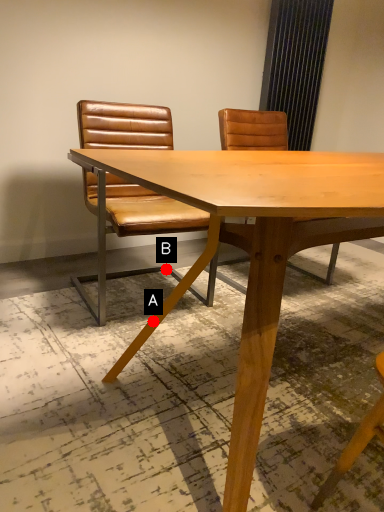
Question: Two points are circled on the image, labeled by A and B beside each circle. Which point is closer to the camera?

Choices:
 (A) A is closer
 (B) B is closer

Answer: (A)